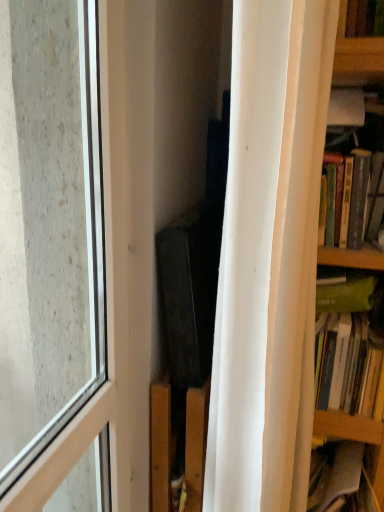
Identify the location of green matte book at right, which appears as the 1th book when ordered from the bottom. (349, 344).

You are a GUI agent. You are given a task and a screenshot of the screen. Output one action in this format:
    pyautogui.click(x=<x>, y=<y>)
    Task: Click on the hardcover books at right, acting as the first book starting from the top
    The height and width of the screenshot is (512, 384).
    Given the screenshot: What is the action you would take?
    pyautogui.click(x=346, y=112)

What do you see at coordinates (269, 257) in the screenshot? I see `white matte curtain at right` at bounding box center [269, 257].

Locate an element on the screen. This screenshot has height=512, width=384. green matte book at right, which appears as the 1th book when ordered from the bottom is located at coordinates (349, 344).

Is white matte curtain at right far away from green matte book at right, arranged as the second book when viewed from the top?

No, white matte curtain at right is not far away from green matte book at right, arranged as the second book when viewed from the top.

In the scene shown: Is white matte curtain at right oriented towards green matte book at right, which appears as the 1th book when ordered from the bottom?

No, white matte curtain at right is not aimed at green matte book at right, which appears as the 1th book when ordered from the bottom.

From a real-world perspective, who is located lower, white matte curtain at right or green matte book at right, which appears as the 1th book when ordered from the bottom?

green matte book at right, which appears as the 1th book when ordered from the bottom, from a real-world perspective.

In terms of size, does white matte curtain at right appear bigger or smaller than green matte book at right, arranged as the second book when viewed from the top?

Clearly, white matte curtain at right is larger in size than green matte book at right, arranged as the second book when viewed from the top.

Which object is closer to the camera, green matte book at right, arranged as the second book when viewed from the top, or white matte curtain at right?

Positioned in front is white matte curtain at right.

Is green matte book at right, which appears as the 1th book when ordered from the bottom, oriented away from white matte curtain at right?

No, green matte book at right, which appears as the 1th book when ordered from the bottom, is not facing the opposite direction of white matte curtain at right.

Considering the relative positions of green matte book at right, which appears as the 1th book when ordered from the bottom, and white matte curtain at right in the image provided, is green matte book at right, which appears as the 1th book when ordered from the bottom, to the left of white matte curtain at right from the viewer's perspective?

In fact, green matte book at right, which appears as the 1th book when ordered from the bottom, is to the right of white matte curtain at right.

Are green matte book at right, which appears as the 1th book when ordered from the bottom, and white matte curtain at right far apart?

Actually, green matte book at right, which appears as the 1th book when ordered from the bottom, and white matte curtain at right are a little close together.

From the image's perspective, is white matte curtain at right under hardcover books at right, acting as the first book starting from the top?

Yes.

Who is more distant, white matte curtain at right or hardcover books at right, acting as the first book starting from the top?

Positioned behind is hardcover books at right, acting as the first book starting from the top.

Considering the sizes of objects white matte curtain at right and hardcover books at right, the 2th book ordered from the bottom, in the image provided, who is smaller, white matte curtain at right or hardcover books at right, the 2th book ordered from the bottom,?

hardcover books at right, the 2th book ordered from the bottom.

Is white matte curtain at right to the right of hardcover books at right, acting as the first book starting from the top, from the viewer's perspective?

No.

This screenshot has height=512, width=384. Find the location of `book above the white matte curtain at right (from a real-world perspective)`. book above the white matte curtain at right (from a real-world perspective) is located at coordinates (346, 112).

Can you confirm if hardcover books at right, acting as the first book starting from the top, is thinner than white matte curtain at right?

No.

Is hardcover books at right, the 2th book ordered from the bottom, far away from white matte curtain at right?

Actually, hardcover books at right, the 2th book ordered from the bottom, and white matte curtain at right are a little close together.

Between hardcover books at right, acting as the first book starting from the top, and white matte curtain at right, which one has larger size?

Bigger between the two is white matte curtain at right.

Does point (360, 382) lie behind point (84, 379)?

That is False.

Based on the photo, considering the sizes of objects green matte book at right, which appears as the 1th book when ordered from the bottom, and transparent glass window at left in the image provided, who is bigger, green matte book at right, which appears as the 1th book when ordered from the bottom, or transparent glass window at left?

With larger size is transparent glass window at left.

From the image's perspective, is green matte book at right, which appears as the 1th book when ordered from the bottom, on transparent glass window at left?

No.

Between green matte book at right, arranged as the second book when viewed from the top, and transparent glass window at left, which one has smaller width?

With smaller width is transparent glass window at left.

Does hardcover books at right, the 2th book ordered from the bottom, have a lesser height compared to transparent glass window at left?

Yes, hardcover books at right, the 2th book ordered from the bottom, is shorter than transparent glass window at left.

From a real-world perspective, is hardcover books at right, the 2th book ordered from the bottom, below transparent glass window at left?

No, from a real-world perspective, hardcover books at right, the 2th book ordered from the bottom, is not below transparent glass window at left.

Is hardcover books at right, acting as the first book starting from the top, looking in the opposite direction of transparent glass window at left?

No, transparent glass window at left is not at the back of hardcover books at right, acting as the first book starting from the top.

Does white matte curtain at right lie behind transparent glass window at left?

Yes, white matte curtain at right is further from the camera.

Is white matte curtain at right positioned beyond the bounds of transparent glass window at left?

Yes, white matte curtain at right is not within transparent glass window at left.

Considering the sizes of white matte curtain at right and transparent glass window at left in the image, is white matte curtain at right wider or thinner than transparent glass window at left?

Considering their sizes, white matte curtain at right looks broader than transparent glass window at left.

Is white matte curtain at right at the right side of transparent glass window at left?

Indeed, white matte curtain at right is positioned on the right side of transparent glass window at left.

Locate an element on the screen. This screenshot has height=512, width=384. the 2nd book to the right of the white matte curtain at right, starting your count from the anchor is located at coordinates (349, 344).

At what (x,y) coordinates should I click in order to perform the action: click on curtain that is in front of the green matte book at right, which appears as the 1th book when ordered from the bottom. Please return your answer as a coordinate pair (x, y). The width and height of the screenshot is (384, 512). Looking at the image, I should click on (269, 257).

Estimate the real-world distances between objects in this image. Which object is further from hardcover books at right, acting as the first book starting from the top, white matte curtain at right or green matte book at right, arranged as the second book when viewed from the top?

Based on the image, white matte curtain at right appears to be further to hardcover books at right, acting as the first book starting from the top.

From the image, which object appears to be farther from hardcover books at right, the 2th book ordered from the bottom, white matte curtain at right or transparent glass window at left?

transparent glass window at left lies further to hardcover books at right, the 2th book ordered from the bottom, than the other object.

When comparing their distances from transparent glass window at left, does hardcover books at right, the 2th book ordered from the bottom, or white matte curtain at right seem closer?

white matte curtain at right.

Considering their positions, is white matte curtain at right positioned closer to green matte book at right, which appears as the 1th book when ordered from the bottom, than transparent glass window at left?

Based on the image, white matte curtain at right appears to be nearer to green matte book at right, which appears as the 1th book when ordered from the bottom.

From the image, which object appears to be farther from white matte curtain at right, transparent glass window at left or green matte book at right, which appears as the 1th book when ordered from the bottom?

transparent glass window at left is further to white matte curtain at right.

Estimate the real-world distances between objects in this image. Which object is further from hardcover books at right, the 2th book ordered from the bottom, green matte book at right, arranged as the second book when viewed from the top, or white matte curtain at right?

The object further to hardcover books at right, the 2th book ordered from the bottom, is white matte curtain at right.

Based on their spatial positions, is green matte book at right, arranged as the second book when viewed from the top, or transparent glass window at left closer to hardcover books at right, acting as the first book starting from the top?

green matte book at right, arranged as the second book when viewed from the top.

Estimate the real-world distances between objects in this image. Which object is further from white matte curtain at right, green matte book at right, which appears as the 1th book when ordered from the bottom, or hardcover books at right, the 2th book ordered from the bottom?

Among the two, hardcover books at right, the 2th book ordered from the bottom, is located further to white matte curtain at right.

Image resolution: width=384 pixels, height=512 pixels. I want to click on book between white matte curtain at right and green matte book at right, arranged as the second book when viewed from the top, from front to back, so click(346, 112).

This screenshot has height=512, width=384. In order to click on curtain between transparent glass window at left and hardcover books at right, the 2th book ordered from the bottom in this screenshot , I will do 269,257.

Image resolution: width=384 pixels, height=512 pixels. I want to click on book between transparent glass window at left and green matte book at right, which appears as the 1th book when ordered from the bottom, from left to right, so click(x=346, y=112).

The height and width of the screenshot is (512, 384). What are the coordinates of `curtain between transparent glass window at left and green matte book at right, which appears as the 1th book when ordered from the bottom, in the horizontal direction` in the screenshot? It's located at (269, 257).